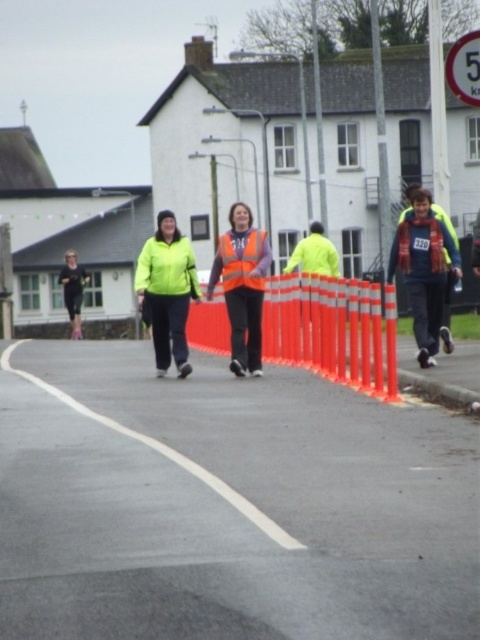
Between neon green jacket at center and black running suit at left, which one has less height?

neon green jacket at center is shorter.

Is neon green jacket at center shorter than black running suit at left?

Indeed, neon green jacket at center has a lesser height compared to black running suit at left.

Is point (156, 333) less distant than point (82, 300)?

Yes, it is.

The width and height of the screenshot is (480, 640). What are the coordinates of `neon green jacket at center` in the screenshot? It's located at (168, 291).

Is green matte jacket at center to the right of black running suit at left from the viewer's perspective?

Yes, green matte jacket at center is to the right of black running suit at left.

Does green matte jacket at center come behind black running suit at left?

No.

Locate an element on the screen. Image resolution: width=480 pixels, height=640 pixels. green matte jacket at center is located at coordinates (167, 268).

Is neon green jacket at center thinner than high visibility fabric safety vest at center?

Incorrect, neon green jacket at center's width is not less than high visibility fabric safety vest at center's.

Does neon green jacket at center have a lesser height compared to high visibility fabric safety vest at center?

Incorrect, neon green jacket at center's height does not fall short of high visibility fabric safety vest at center's.

Between point (163, 371) and point (220, 248), which one is positioned behind?

Point (163, 371)

Locate an element on the screen. neon green jacket at center is located at coordinates (168, 291).